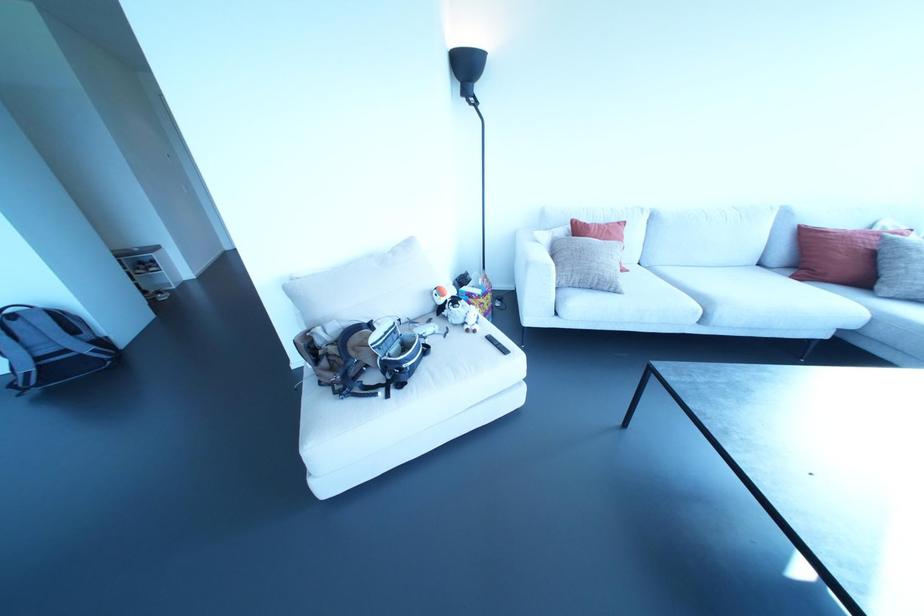
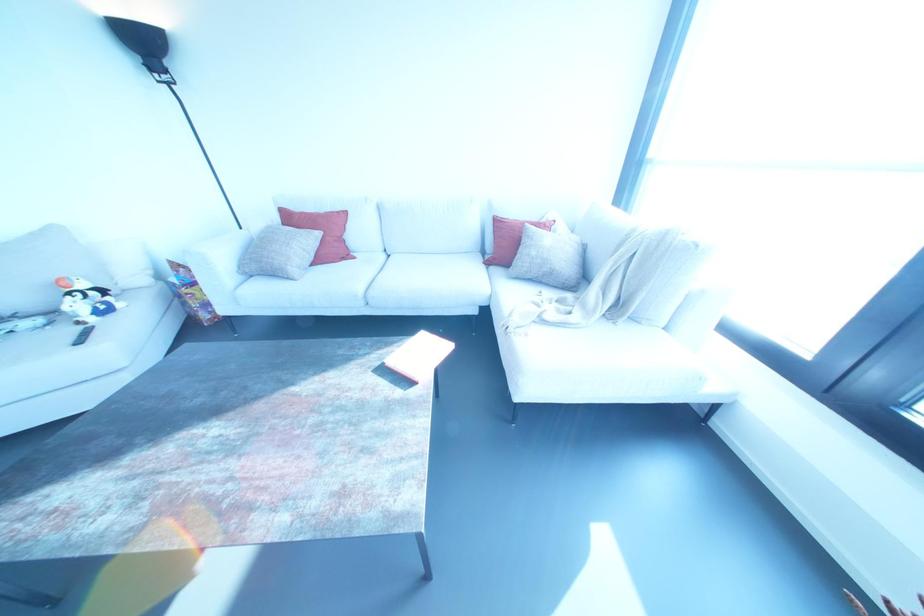
The point at (x=480, y=300) is marked in the first image. Where is the corresponding point in the second image?

(184, 290)